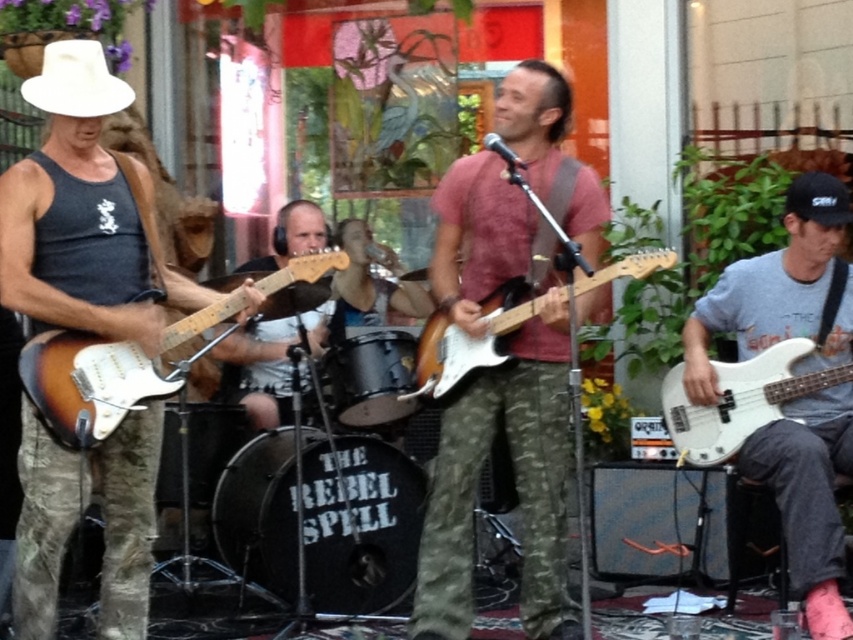
Question: Which object is farther from the camera taking this photo?

Choices:
 (A) gray cotton t-shirt at right
 (B) matte white guitar at center
 (C) matte white electric guitar at center

Answer: (B)

Question: Which of the following is the farthest from the observer?

Choices:
 (A) (368, 346)
 (B) (508, 355)

Answer: (A)

Question: Does white matte bass guitar at right appear on the right side of matte white electric guitar at center?

Choices:
 (A) yes
 (B) no

Answer: (A)

Question: Does gray cotton t-shirt at right appear over matte white guitar at center?

Choices:
 (A) no
 (B) yes

Answer: (A)

Question: Is black drumhead at center further to camera compared to sunburst wood electric guitar at left?

Choices:
 (A) no
 (B) yes

Answer: (B)

Question: Which of these objects is positioned farthest from the black drumhead at center?

Choices:
 (A) sunburst wood electric guitar at left
 (B) camouflage pants at center
 (C) matte white electric guitar at center

Answer: (A)